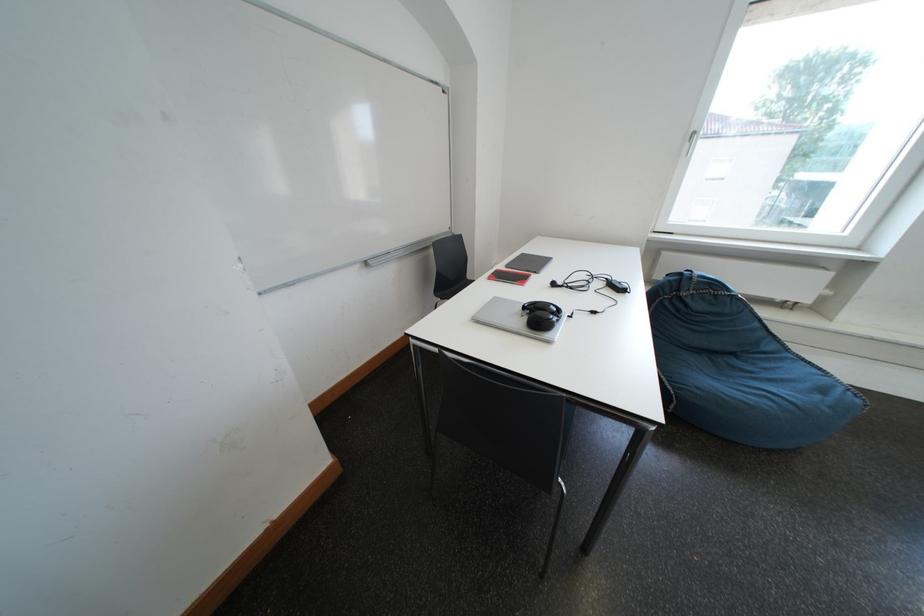
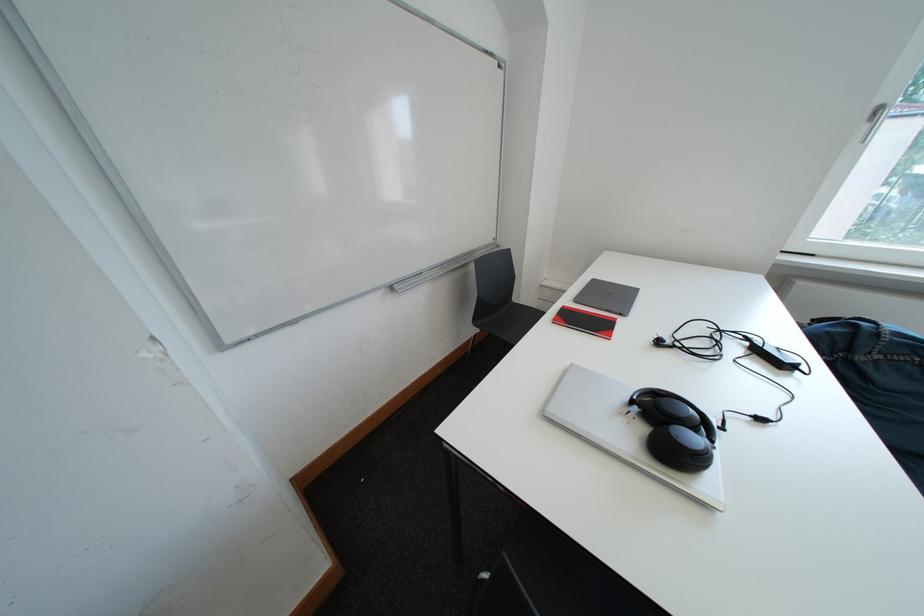
Where in the second image is the point corresponding to point 502,282 from the first image?

(565, 325)